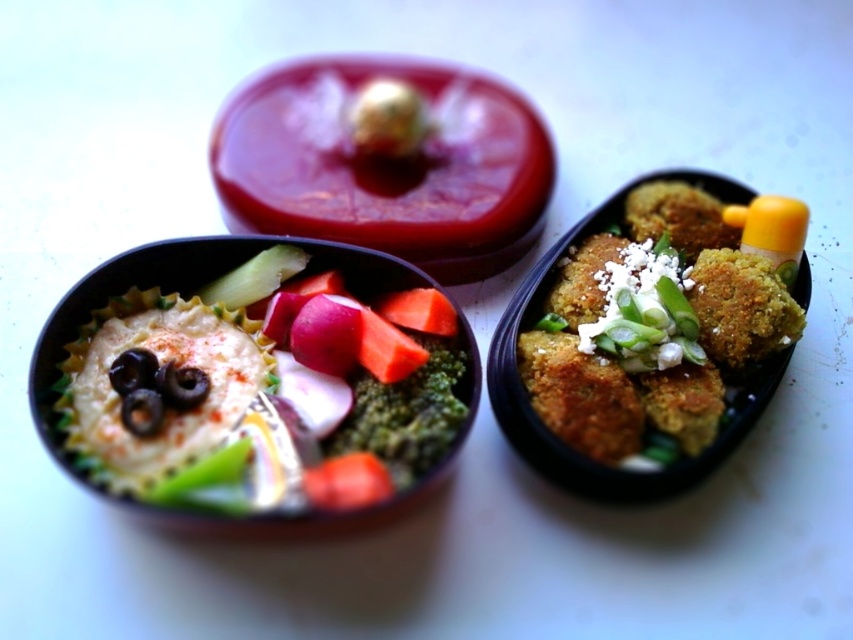
You are a food critic evaluating the bento box. You notice the green leafytexturedsalad at left and the green matte broccoli at center. Which of these two items is positioned higher in the left compartment?

The green leafytexturedsalad at left is above the green matte broccoli at center, so it is positioned higher in the left compartment.

You are a food critic analyzing the bento box. You notice the green leafytexturedsalad at left and the golden crispy balls at right. Which of these two items is taller in the image?

The golden crispy balls at right are taller than the green leafytexturedsalad at left.